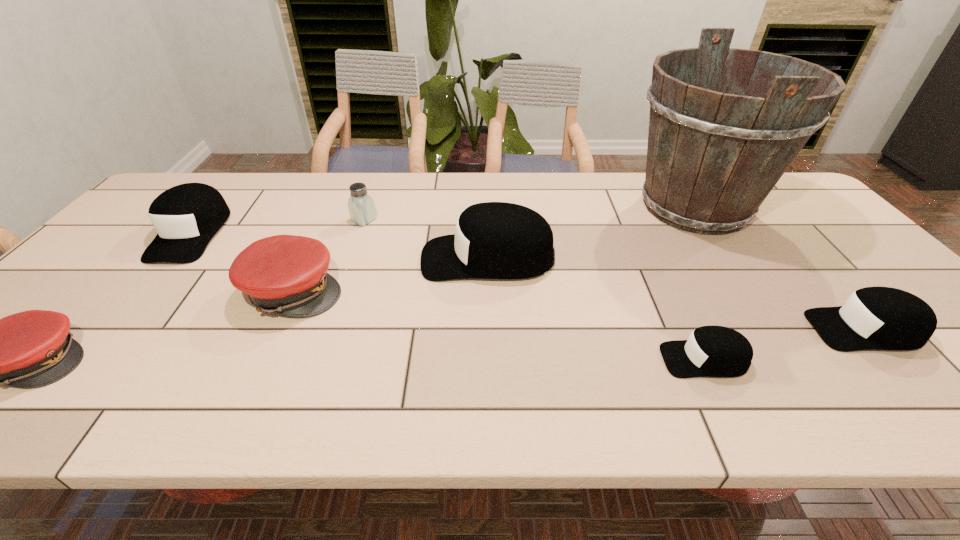
At what (x,y) coordinates should I click in order to perform the action: click on bucket. Please return your answer as a coordinate pair (x, y). Looking at the image, I should click on (714, 154).

Identify the location of the fourth object from right to left. The image size is (960, 540). [x=493, y=240].

Locate an element on the screen. The width and height of the screenshot is (960, 540). the second tallest object is located at coordinates (493, 240).

The height and width of the screenshot is (540, 960). Identify the location of the leftmost black cap. (187, 216).

This screenshot has width=960, height=540. In order to click on saltshaker in this screenshot , I will do `click(361, 206)`.

I want to click on the fourth cap from right to left, so click(286, 274).

Image resolution: width=960 pixels, height=540 pixels. In order to click on the bigger red cap in this screenshot , I will do `click(286, 274)`.

You are a GUI agent. You are given a task and a screenshot of the screen. Output one action in this format:
    pyautogui.click(x=<x>, y=<y>)
    Task: Click on the rightmost black cap
    
    Given the screenshot: What is the action you would take?
    pyautogui.click(x=873, y=318)

This screenshot has width=960, height=540. Identify the location of the second smallest black cap. point(873,318).

You are a GUI agent. You are given a task and a screenshot of the screen. Output one action in this format:
    pyautogui.click(x=<x>, y=<y>)
    Task: Click on the third black cap from left to right
    The image size is (960, 540).
    Given the screenshot: What is the action you would take?
    pyautogui.click(x=711, y=351)